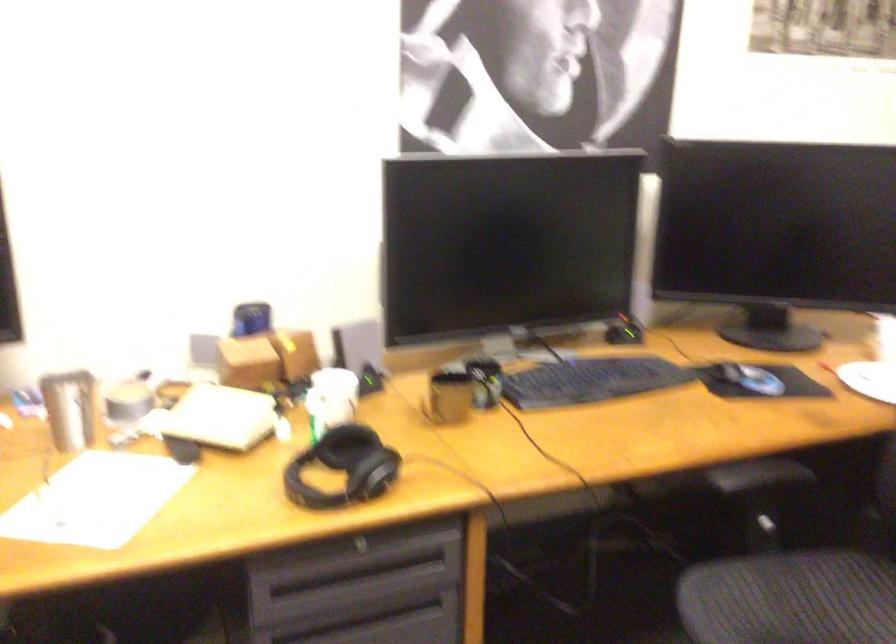
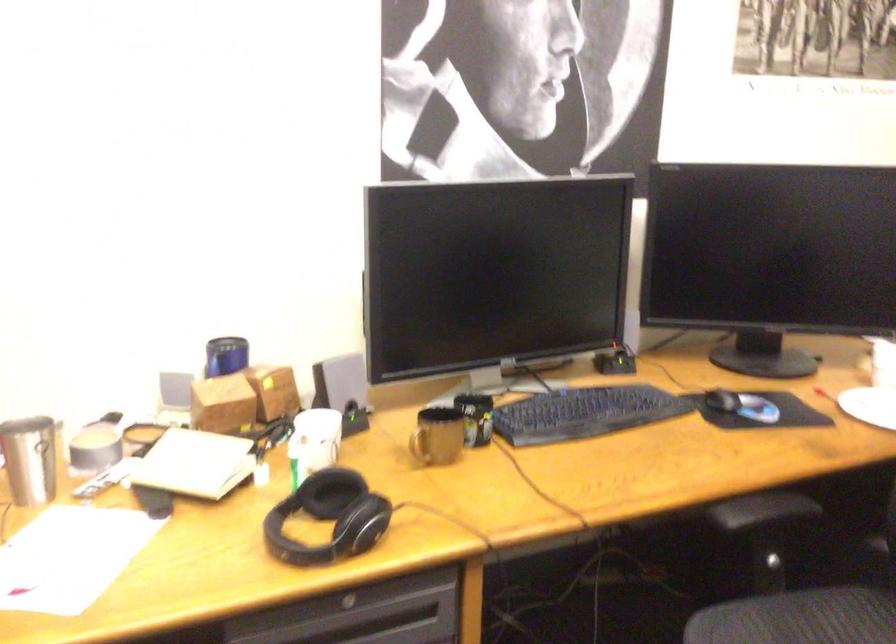
The point at (246, 365) is marked in the first image. Where is the corresponding point in the second image?

(222, 404)